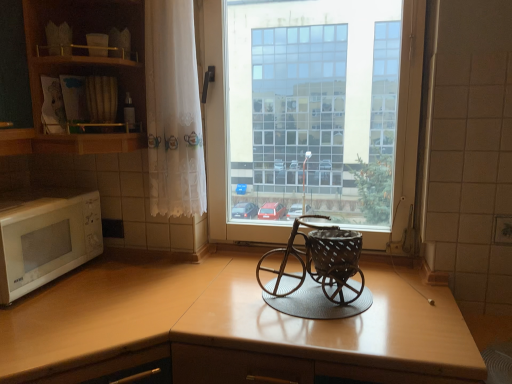
The image size is (512, 384). What do you see at coordinates (227, 321) in the screenshot?
I see `wooden at center` at bounding box center [227, 321].

The height and width of the screenshot is (384, 512). Find the location of `white lace curtain at left`. white lace curtain at left is located at coordinates (173, 111).

The width and height of the screenshot is (512, 384). Identify the location of transparent glass window at center. (222, 137).

What is the approximate width of light brown laminate counter top at left?

light brown laminate counter top at left is 34.03 inches wide.

This screenshot has height=384, width=512. I want to click on wooden at center, so click(x=227, y=321).

From a real-world perspective, who is located higher, rustic metal bicycle at center or white matte microwave at left?

white matte microwave at left is physically above.

Is rustic metal bicycle at center spatially inside white matte microwave at left, or outside of it?

rustic metal bicycle at center is spatially situated outside white matte microwave at left.

Consider the image. Which is more to the left, rustic metal bicycle at center or white matte microwave at left?

Positioned to the left is white matte microwave at left.

Considering the sizes of objects rustic metal bicycle at center and white matte microwave at left in the image provided, who is taller, rustic metal bicycle at center or white matte microwave at left?

white matte microwave at left.

Is wooden cabinet at upper left far from white matte microwave at left?

No, wooden cabinet at upper left is not far away from white matte microwave at left.

Is point (89, 6) closer or farther from the camera than point (10, 242)?

Clearly, point (89, 6) is more distant from the camera than point (10, 242).

What are the coordinates of `cabinetry on the right of white matte microwave at left` in the screenshot? It's located at (80, 73).

How many degrees apart are the facing directions of wooden cabinet at upper left and wooden at center?

94.4 degrees.

Is wooden at center located within wooden cabinet at upper left?

No, wooden at center is not inside wooden cabinet at upper left.

From a real-world perspective, is wooden cabinet at upper left positioned above or below wooden at center?

wooden cabinet at upper left is situated higher than wooden at center in the real world.

From the picture: From the image's perspective, between wooden cabinet at upper left and rustic metal bicycle at center, which one is located above?

From the image's view, wooden cabinet at upper left is above.

Between point (109, 72) and point (283, 307), which one is positioned in front?

Positioned in front is point (283, 307).

From a real-world perspective, which is physically above, wooden cabinet at upper left or rustic metal bicycle at center?

wooden cabinet at upper left is physically above.

I want to click on microwave oven on the left of transparent glass window at center, so click(x=45, y=237).

From a real-world perspective, is white matte microwave at left physically located above or below transparent glass window at center?

In terms of real-world spatial position, white matte microwave at left is below transparent glass window at center.

Measure the distance from white matte microwave at left to transparent glass window at center.

The distance of white matte microwave at left from transparent glass window at center is 24.47 inches.

From the image's perspective, is white matte microwave at left below transparent glass window at center?

Yes, from the image's perspective, white matte microwave at left is below transparent glass window at center.

Between light brown laminate counter top at left and white matte microwave at left, which one has larger size?

With larger size is light brown laminate counter top at left.

Would you say light brown laminate counter top at left is inside or outside white matte microwave at left?

The correct answer is: outside.

Does light brown laminate counter top at left touch white matte microwave at left?

They are not placed beside each other.

Would you say wooden at center is to the left or to the right of wooden cabinet at upper left in the picture?

Clearly, wooden at center is on the right of wooden cabinet at upper left in the image.

Relative to wooden cabinet at upper left, is wooden at center in front or behind?

wooden at center is in front of wooden cabinet at upper left.

Can you confirm if wooden at center is taller than wooden cabinet at upper left?

Yes, wooden at center is taller than wooden cabinet at upper left.

Is point (347, 348) closer to viewer compared to point (116, 143)?

Yes, it is.

The height and width of the screenshot is (384, 512). In order to click on microwave oven that appears above the rustic metal bicycle at center (from the image's perspective) in this screenshot , I will do `click(45, 237)`.

The height and width of the screenshot is (384, 512). In order to click on microwave oven on the left of wooden cabinet at upper left in this screenshot , I will do `click(45, 237)`.

When comparing their distances from light brown laminate counter top at left, does rustic metal bicycle at center or wooden cabinet at upper left seem closer?

rustic metal bicycle at center is closer to light brown laminate counter top at left.

Considering their positions, is wooden at center positioned closer to white lace curtain at left than white matte microwave at left?

Among the two, white matte microwave at left is located nearer to white lace curtain at left.

Based on their spatial positions, is light brown laminate counter top at left or white matte microwave at left further from wooden at center?

The object further to wooden at center is white matte microwave at left.

Looking at the image, which one is located closer to transparent glass window at center, rustic metal bicycle at center or wooden at center?

rustic metal bicycle at center is closer to transparent glass window at center.

Looking at this image, looking at the image, which one is located further to rustic metal bicycle at center, wooden at center or transparent glass window at center?

Based on the image, transparent glass window at center appears to be further to rustic metal bicycle at center.

Estimate the real-world distances between objects in this image. Which object is further from rustic metal bicycle at center, wooden at center or wooden cabinet at upper left?

wooden cabinet at upper left is positioned further to the anchor rustic metal bicycle at center.

Estimate the real-world distances between objects in this image. Which object is closer to light brown laminate counter top at left, white lace curtain at left or rustic metal bicycle at center?

rustic metal bicycle at center lies closer to light brown laminate counter top at left than the other object.

Based on their spatial positions, is wooden at center or white matte microwave at left further from wooden cabinet at upper left?

wooden at center is further to wooden cabinet at upper left.

Find the location of a particular element. baby carriage between wooden cabinet at upper left and light brown laminate counter top at left from top to bottom is located at coordinates (319, 275).

I want to click on baby carriage between white lace curtain at left and wooden at center in the vertical direction, so [319, 275].

I want to click on curtain between white matte microwave at left and transparent glass window at center, so pos(173,111).

Where is `countertop between transparent glass window at center and light brown laminate counter top at left from top to bottom`? This screenshot has height=384, width=512. countertop between transparent glass window at center and light brown laminate counter top at left from top to bottom is located at coordinates (227, 321).